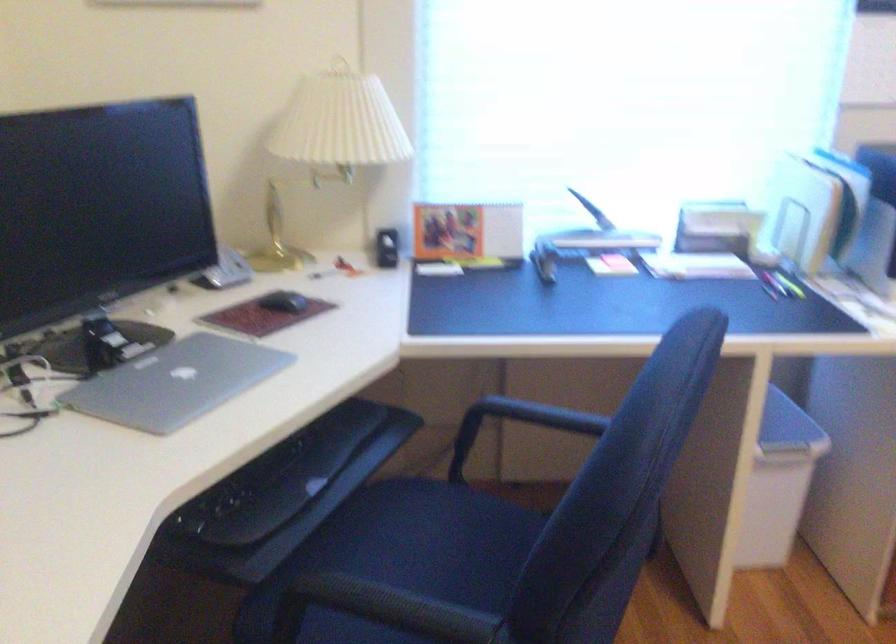
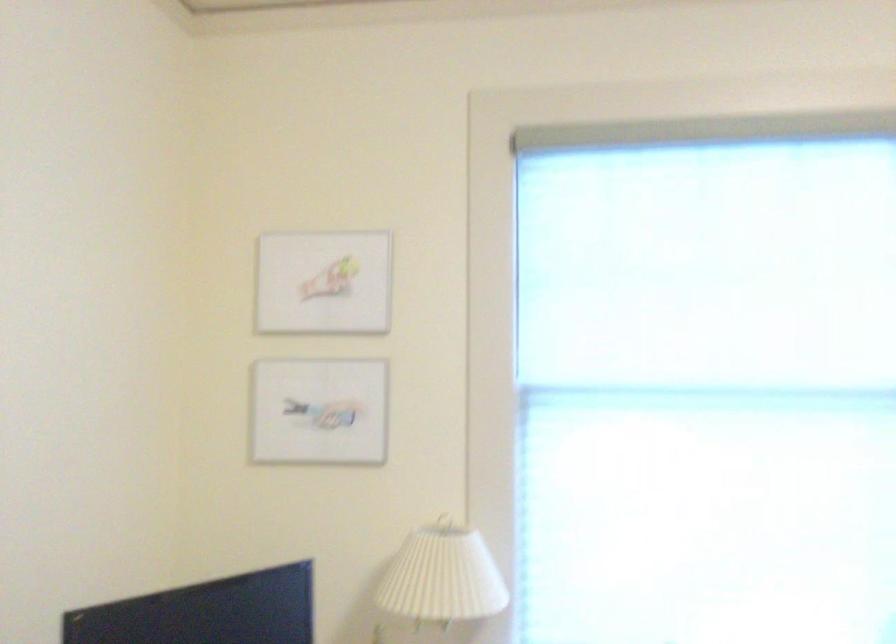
Question: The first image is from the beginning of the video and the second image is from the end. How did the camera likely rotate when shooting the video?

Choices:
 (A) Left
 (B) Right
 (C) Up
 (D) Down

Answer: (C)